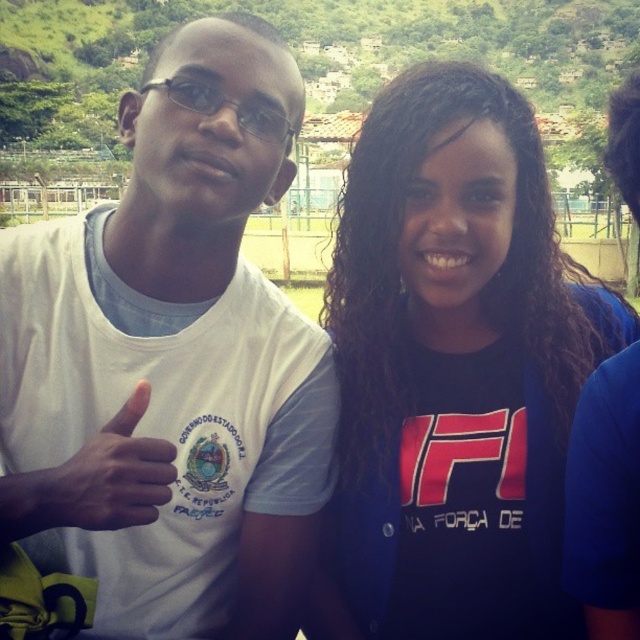
Question: Which object is positioned farthest from the white matte hand at left?

Choices:
 (A) dark blue jersey at center
 (B) white matte t-shirt at center

Answer: (A)

Question: Estimate the real-world distances between objects in this image. Which object is farther from the dark blue jersey at center?

Choices:
 (A) white matte hand at left
 (B) white matte t-shirt at center

Answer: (A)

Question: Does dark blue jersey at center appear under white matte hand at left?

Choices:
 (A) yes
 (B) no

Answer: (B)

Question: Considering the real-world distances, which object is closest to the dark blue jersey at center?

Choices:
 (A) white matte t-shirt at center
 (B) white matte hand at left

Answer: (A)

Question: Can you confirm if white matte t-shirt at center is positioned to the left of dark blue jersey at center?

Choices:
 (A) no
 (B) yes

Answer: (B)

Question: Can you confirm if dark blue jersey at center is thinner than white matte hand at left?

Choices:
 (A) yes
 (B) no

Answer: (B)